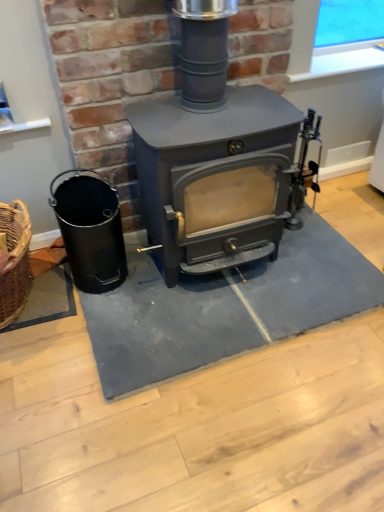
Question: Is matte gray wood burning stove at center with black matte bucket at left?

Choices:
 (A) no
 (B) yes

Answer: (A)

Question: Is matte gray wood burning stove at center thinner than black matte bucket at left?

Choices:
 (A) no
 (B) yes

Answer: (A)

Question: Does matte gray wood burning stove at center turn towards black matte bucket at left?

Choices:
 (A) no
 (B) yes

Answer: (A)

Question: Can you confirm if matte gray wood burning stove at center is smaller than black matte bucket at left?

Choices:
 (A) no
 (B) yes

Answer: (A)

Question: Is matte gray wood burning stove at center far away from black matte bucket at left?

Choices:
 (A) yes
 (B) no

Answer: (B)

Question: Considering the positions of black matte bucket at left and matte gray wood burning stove at center in the image, is black matte bucket at left bigger or smaller than matte gray wood burning stove at center?

Choices:
 (A) small
 (B) big

Answer: (A)

Question: From a real-world perspective, is black matte bucket at left positioned above or below matte gray wood burning stove at center?

Choices:
 (A) above
 (B) below

Answer: (B)

Question: Is black matte bucket at left situated inside matte gray wood burning stove at center or outside?

Choices:
 (A) outside
 (B) inside

Answer: (A)

Question: Considering the positions of point (99, 208) and point (175, 251), is point (99, 208) closer or farther from the camera than point (175, 251)?

Choices:
 (A) closer
 (B) farther

Answer: (B)

Question: Is matte gray wood burning stove at center inside the boundaries of gray rubber doormat at center, or outside?

Choices:
 (A) inside
 (B) outside

Answer: (B)

Question: Is matte gray wood burning stove at center in front of or behind gray rubber doormat at center in the image?

Choices:
 (A) front
 (B) behind

Answer: (A)

Question: From a real-world perspective, relative to gray rubber doormat at center, is matte gray wood burning stove at center vertically above or below?

Choices:
 (A) below
 (B) above

Answer: (B)

Question: Considering the relative positions of matte gray wood burning stove at center and gray rubber doormat at center in the image provided, is matte gray wood burning stove at center to the left or to the right of gray rubber doormat at center?

Choices:
 (A) left
 (B) right

Answer: (A)

Question: Considering the positions of gray rubber doormat at center and matte gray wood burning stove at center in the image, is gray rubber doormat at center wider or thinner than matte gray wood burning stove at center?

Choices:
 (A) wide
 (B) thin

Answer: (A)

Question: From a real-world perspective, is gray rubber doormat at center physically located above or below matte gray wood burning stove at center?

Choices:
 (A) below
 (B) above

Answer: (A)